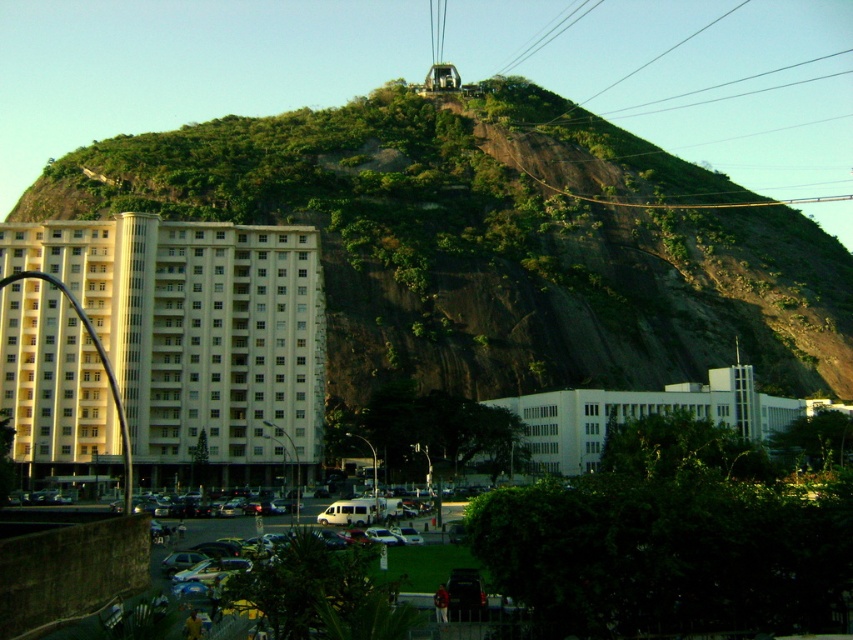
Can you confirm if green leafy hillside at upper center is positioned below beige concrete building at left?

Actually, green leafy hillside at upper center is above beige concrete building at left.

Who is more forward, [845,314] or [312,365]?

Point [312,365] is more forward.

At what (x,y) coordinates should I click in order to perform the action: click on green leafy hillside at upper center. Please return your answer as a coordinate pair (x, y). This screenshot has height=640, width=853. Looking at the image, I should click on (496, 243).

Does beige concrete building at left have a lesser width compared to metallic cable car at upper center?

Yes.

Who is more forward, [265,330] or [543,77]?

Positioned in front is point [265,330].

You are a GUI agent. You are given a task and a screenshot of the screen. Output one action in this format:
    pyautogui.click(x=<x>, y=<y>)
    Task: Click on the beige concrete building at left
    The width and height of the screenshot is (853, 640).
    Given the screenshot: What is the action you would take?
    pyautogui.click(x=198, y=336)

Is point (57, 394) positioned behind point (572, 445)?

That is False.

Is point (155, 364) in front of point (717, 371)?

That is True.

Where is `beige concrete building at left`? beige concrete building at left is located at coordinates (198, 336).

Where is `beige concrete building at left`? The image size is (853, 640). beige concrete building at left is located at coordinates (198, 336).